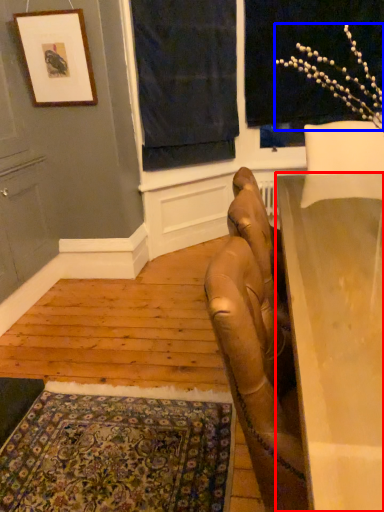
Question: Which object appears closest to the camera in this image, table (highlighted by a red box) or flower (highlighted by a blue box)?

Choices:
 (A) table
 (B) flower

Answer: (A)